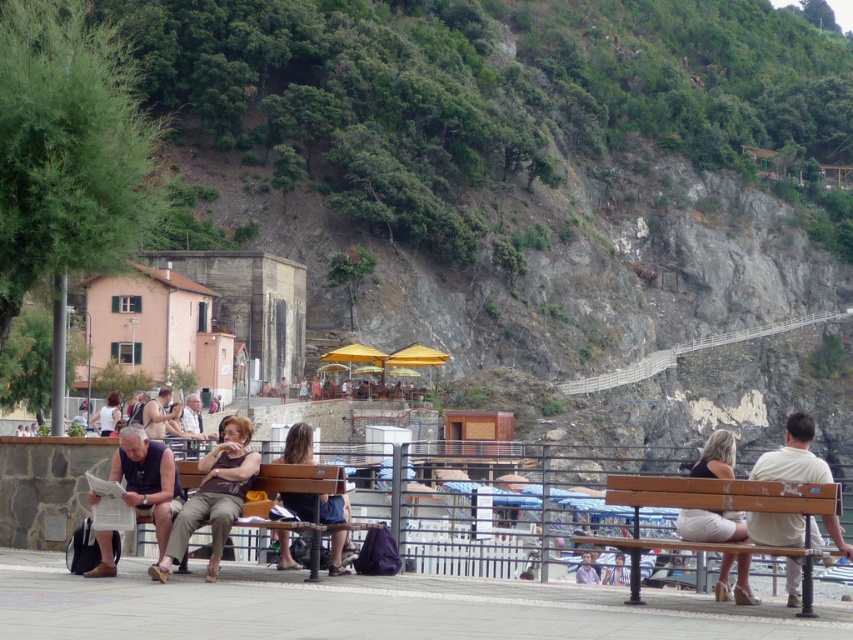
You are standing at the riverside and see a light beige fabric skirt at center. If you want to reach it within 5 seconds, what is the minimum speed you need to move towards it?

The light beige fabric skirt at center is 29.39 meters away from the viewer. To reach it within 5 seconds, you would need to move at a minimum speed of 5.88 meters per second.

You are standing at point (109, 397) and want to walk to point (200, 468). Is the destination point ahead of you or behind you?

The destination point (200, 468) is in front of point (109, 397), so it is ahead of you.

You are planning to sit on the brown wooden bench at center and want to place your matte black tank top at center on it. Can the bench accommodate the tank top?

The brown wooden bench at center has a lesser width compared to matte black tank top at center, so the bench is narrower than the tank top. Therefore, the bench cannot accommodate the tank top.